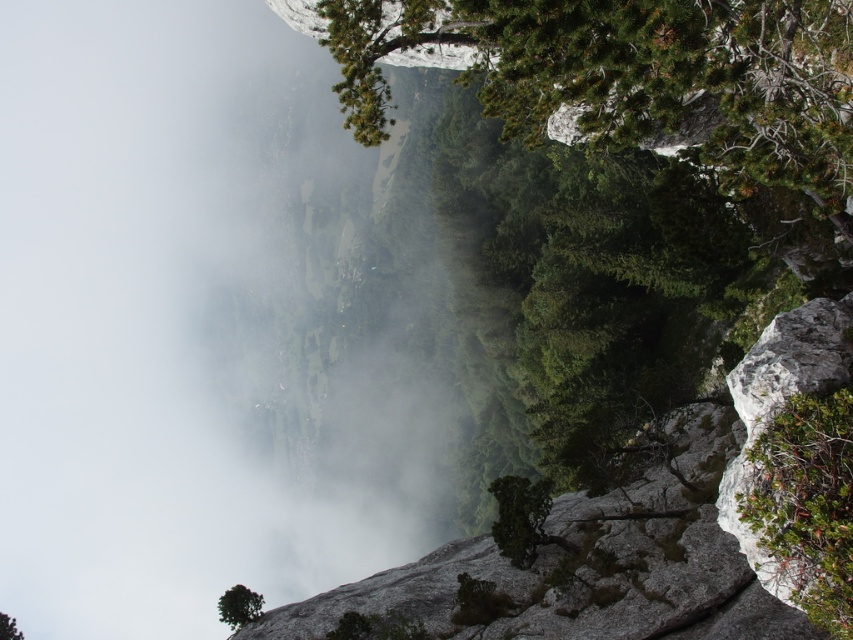
Does green matte tree at lower left have a larger size compared to green leafy tree at upper center?

No.

Can you confirm if green matte tree at lower left is thinner than green leafy tree at upper center?

Yes.

The width and height of the screenshot is (853, 640). In order to click on green matte tree at lower left in this screenshot , I will do point(239,605).

Consider the image. Is the position of white misty fog at upper left less distant than that of green leafy tree at upper center?

No, it is behind green leafy tree at upper center.

In the scene shown: Which is above, white misty fog at upper left or green leafy tree at upper center?

white misty fog at upper left

The width and height of the screenshot is (853, 640). Find the location of `white misty fog at upper left`. white misty fog at upper left is located at coordinates (173, 326).

Where is `white misty fog at upper left`? white misty fog at upper left is located at coordinates (173, 326).

Which is in front, point (741, 92) or point (518, 547)?

Point (741, 92) is more forward.

Is green textured tree at upper right positioned in front of green rough bark tree at center?

Yes, it is.

Where is `green textured tree at upper right`? green textured tree at upper right is located at coordinates (635, 76).

Identify the location of green textured tree at upper right. The image size is (853, 640). point(635,76).